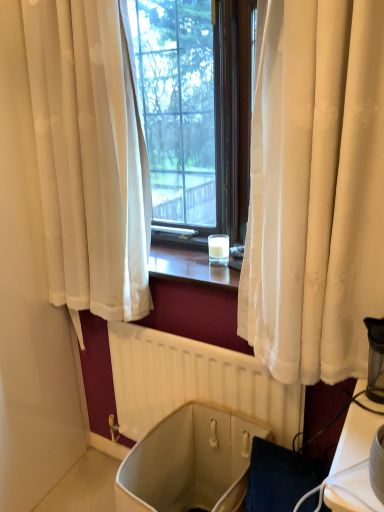
Question: Is beige fabric bath at lower center taller or shorter than white matte radiator at center?

Choices:
 (A) short
 (B) tall

Answer: (A)

Question: From a real-world perspective, is beige fabric bath at lower center physically located above or below white matte radiator at center?

Choices:
 (A) above
 (B) below

Answer: (B)

Question: From the image's perspective, is beige fabric bath at lower center above or below white matte radiator at center?

Choices:
 (A) below
 (B) above

Answer: (A)

Question: From their relative heights in the image, would you say white matte radiator at center is taller or shorter than beige fabric bath at lower center?

Choices:
 (A) tall
 (B) short

Answer: (A)

Question: Is white matte radiator at center to the left or to the right of beige fabric bath at lower center in the image?

Choices:
 (A) left
 (B) right

Answer: (B)

Question: From a real-world perspective, is white matte radiator at center above or below beige fabric bath at lower center?

Choices:
 (A) above
 (B) below

Answer: (A)

Question: Relative to beige fabric bath at lower center, is white matte radiator at center in front or behind?

Choices:
 (A) front
 (B) behind

Answer: (B)